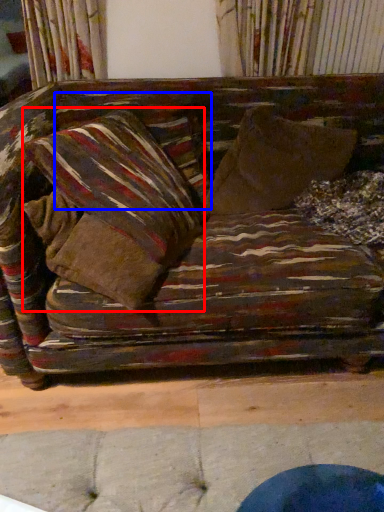
Question: Which of the following is the farthest to the observer, pillow (highlighted by a red box) or pillow (highlighted by a blue box)?

Choices:
 (A) pillow
 (B) pillow

Answer: (B)